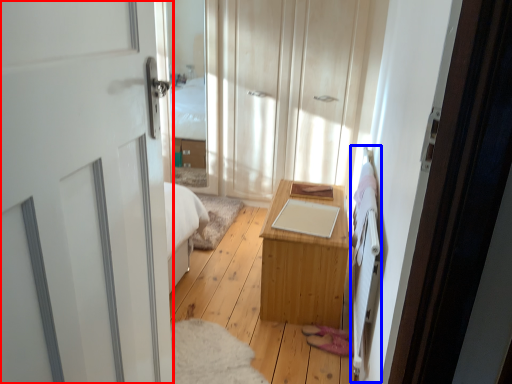
Question: Which object is further to the camera taking this photo, door (highlighted by a red box) or bed frame (highlighted by a blue box)?

Choices:
 (A) door
 (B) bed frame

Answer: (B)